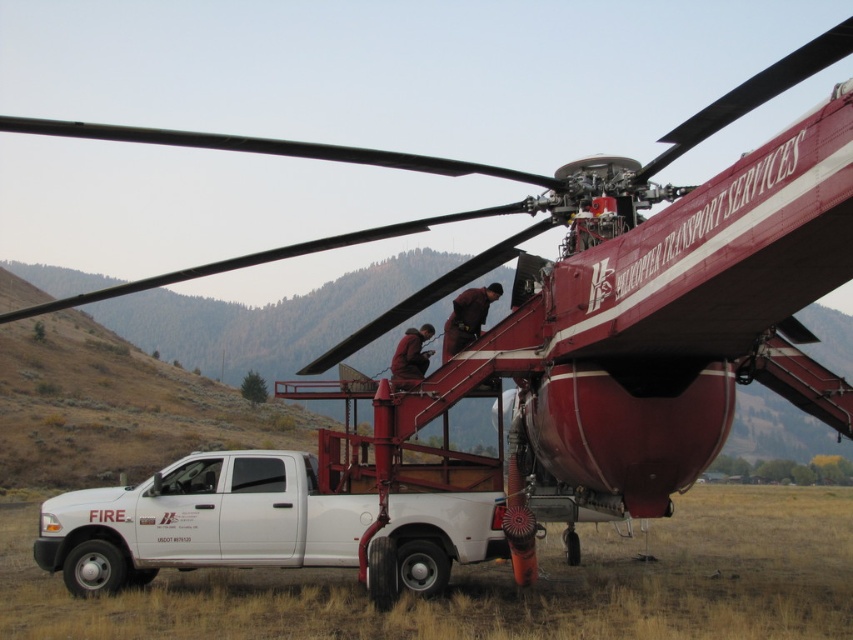
Who is more distant from viewer, (143,540) or (459,330)?

Positioned behind is point (459,330).

Is white matte truck at lower left wider than dark brown leather jacket at center?

Correct, the width of white matte truck at lower left exceeds that of dark brown leather jacket at center.

At what (x,y) coordinates should I click in order to perform the action: click on white matte truck at lower left. Please return your answer as a coordinate pair (x, y). The image size is (853, 640). Looking at the image, I should click on (201, 522).

Consider the image. How distant is white matte truck at lower left from brown fabric jacket at center?

2.99 meters

Is white matte truck at lower left taller than brown fabric jacket at center?

Correct, white matte truck at lower left is much taller as brown fabric jacket at center.

You are a GUI agent. You are given a task and a screenshot of the screen. Output one action in this format:
    pyautogui.click(x=<x>, y=<y>)
    Task: Click on the white matte truck at lower left
    This screenshot has width=853, height=640.
    Given the screenshot: What is the action you would take?
    pyautogui.click(x=201, y=522)

The height and width of the screenshot is (640, 853). Identify the location of white matte truck at lower left. (201, 522).

Does dark brown leather jacket at center appear on the right side of brown fabric jacket at center?

Yes, dark brown leather jacket at center is to the right of brown fabric jacket at center.

Identify the location of dark brown leather jacket at center. (467, 317).

The height and width of the screenshot is (640, 853). What are the coordinates of `dark brown leather jacket at center` in the screenshot? It's located at (467, 317).